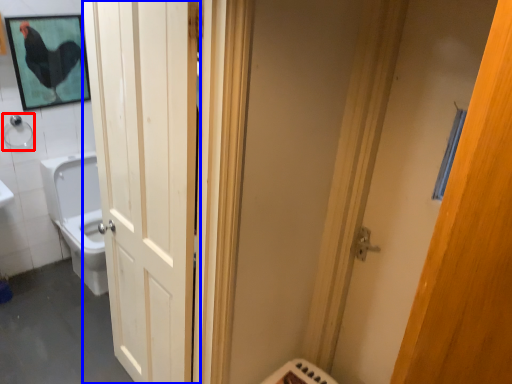
Question: Which of the following is the farthest to the observer, shower (highlighted by a red box) or door (highlighted by a blue box)?

Choices:
 (A) shower
 (B) door

Answer: (A)